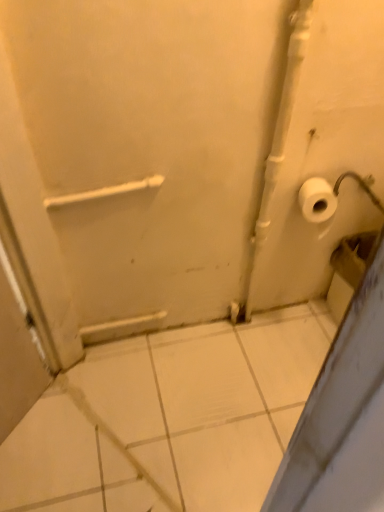
Describe the element at coordinates (279, 138) in the screenshot. I see `white plastic pipe at right` at that location.

You are a GUI agent. You are given a task and a screenshot of the screen. Output one action in this format:
    pyautogui.click(x=<x>, y=<y>)
    Task: Click on the white plastic pipe at right
    This screenshot has width=384, height=512.
    Given the screenshot: What is the action you would take?
    pyautogui.click(x=279, y=138)

This screenshot has height=512, width=384. I want to click on white plastic pipe at right, so click(x=279, y=138).